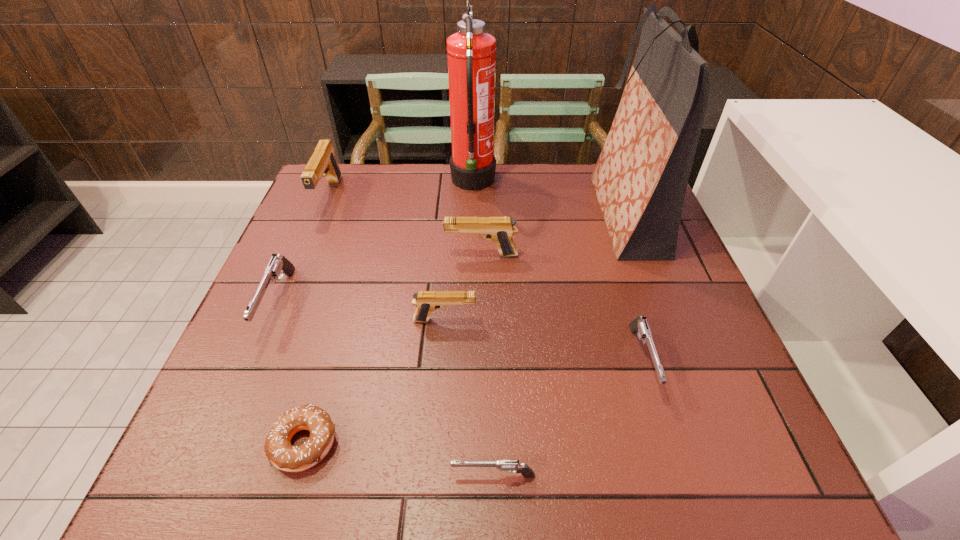
Image resolution: width=960 pixels, height=540 pixels. In the image, there is a desktop. Find the location of `free space at the left edge`. free space at the left edge is located at coordinates (315, 244).

This screenshot has width=960, height=540. I want to click on vacant space at the near right corner of the desktop, so click(766, 463).

The width and height of the screenshot is (960, 540). What are the coordinates of `free area in between the smallest tan pistol and the second biggest silver pistol` in the screenshot? It's located at click(x=543, y=340).

In order to click on vacant area between the third object from left to right and the smallest silver pistol in this screenshot , I will do `click(399, 460)`.

You are a GUI agent. You are given a task and a screenshot of the screen. Output one action in this format:
    pyautogui.click(x=<x>, y=<y>)
    Task: Click on the free space between the shopping bag and the smallest silver pistol
    The height and width of the screenshot is (540, 960).
    Given the screenshot: What is the action you would take?
    pyautogui.click(x=559, y=345)

Identify the location of empty location between the smallest tan pistol and the leftmost silver pistol. (362, 312).

The image size is (960, 540). In order to click on free space between the smallest tan pistol and the doughnut in this screenshot , I will do `click(375, 382)`.

What are the coordinates of `free space that is in between the nearest pistol and the nearest tan pistol` in the screenshot? It's located at (469, 398).

Identify the location of free space between the seventh tallest object and the nearest pistol. (567, 418).

The width and height of the screenshot is (960, 540). In order to click on free area in between the red fire extinguisher and the biggest tan pistol in this screenshot , I will do `click(401, 190)`.